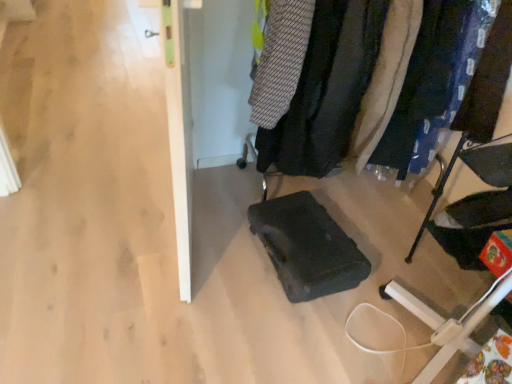
Where is `free region under black fabric chair at lower right (from a real-world perspective)`? The height and width of the screenshot is (384, 512). free region under black fabric chair at lower right (from a real-world perspective) is located at coordinates (455, 283).